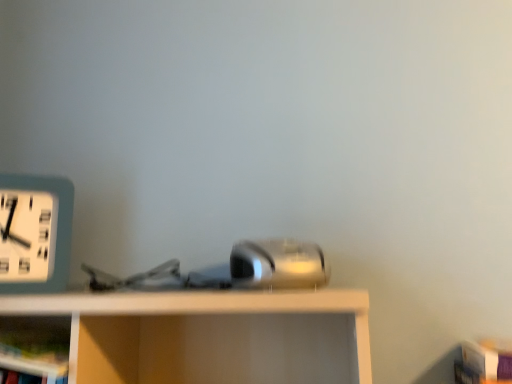
Describe the element at coordinates (35, 233) in the screenshot. I see `teal plastic clock at left` at that location.

Where is `teal plastic clock at left`? teal plastic clock at left is located at coordinates (35, 233).

You are a GUI agent. You are given a task and a screenshot of the screen. Output one action in this format:
    pyautogui.click(x=<x>, y=<y>)
    Task: Click on the teal plastic clock at left
    Image resolution: width=512 pixels, height=384 pixels.
    Given the screenshot: What is the action you would take?
    pyautogui.click(x=35, y=233)